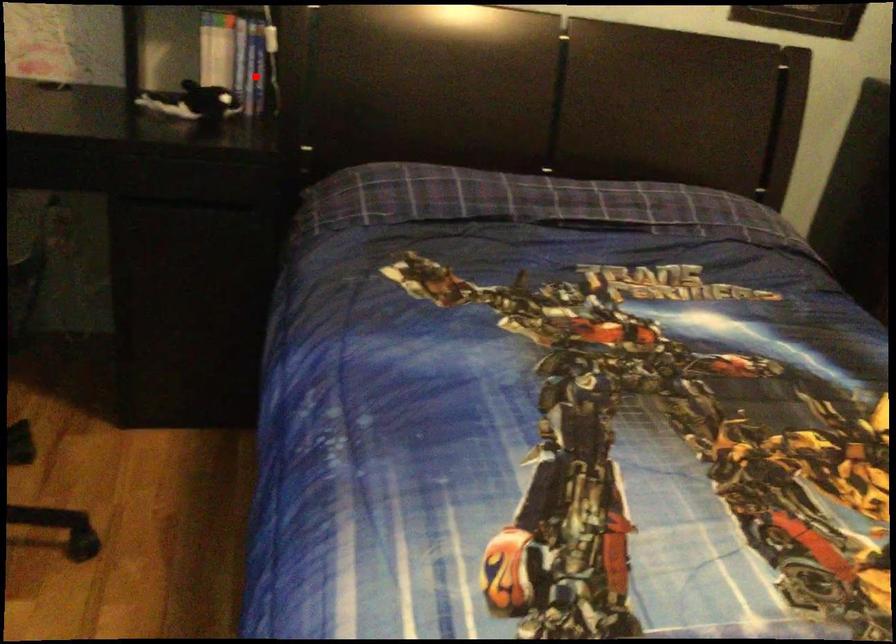
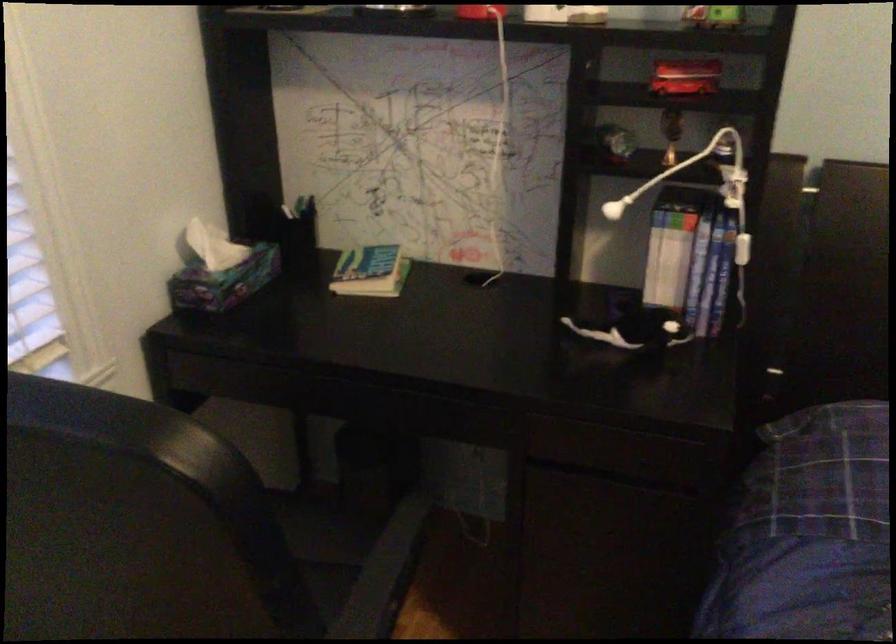
Find the pixel in the second image that matches the highlighted location in the first image.

(707, 288)